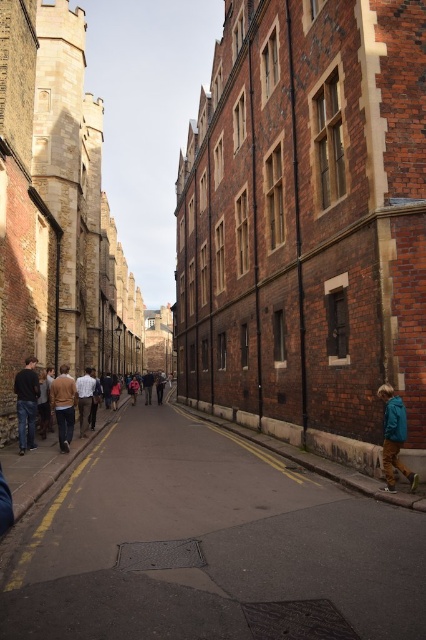
Does light brown leather jacket at center appear on the left side of brown sweater at left?

Incorrect, light brown leather jacket at center is not on the left side of brown sweater at left.

Is point (23, 381) less distant than point (72, 422)?

That is True.

Locate an element on the screen. This screenshot has width=426, height=640. light brown leather jacket at center is located at coordinates point(69,403).

Who is taller, smooth asphalt road at center or light brown leather jacket at center?

Standing taller between the two is light brown leather jacket at center.

Does smooth asphalt road at center have a larger size compared to light brown leather jacket at center?

No, smooth asphalt road at center is not bigger than light brown leather jacket at center.

Between point (371, 500) and point (57, 420), which one is positioned behind?

Positioned behind is point (57, 420).

What are the coordinates of `smooth asphalt road at center` in the screenshot? It's located at pos(210,547).

Does dark blue jeans at left have a lesser height compared to brown sweater at left?

Incorrect, dark blue jeans at left's height does not fall short of brown sweater at left's.

Between dark blue jeans at left and brown sweater at left, which one appears on the right side from the viewer's perspective?

Positioned to the right is brown sweater at left.

The height and width of the screenshot is (640, 426). What do you see at coordinates (26, 403) in the screenshot? I see `dark blue jeans at left` at bounding box center [26, 403].

Where is `dark blue jeans at left`? dark blue jeans at left is located at coordinates (26, 403).